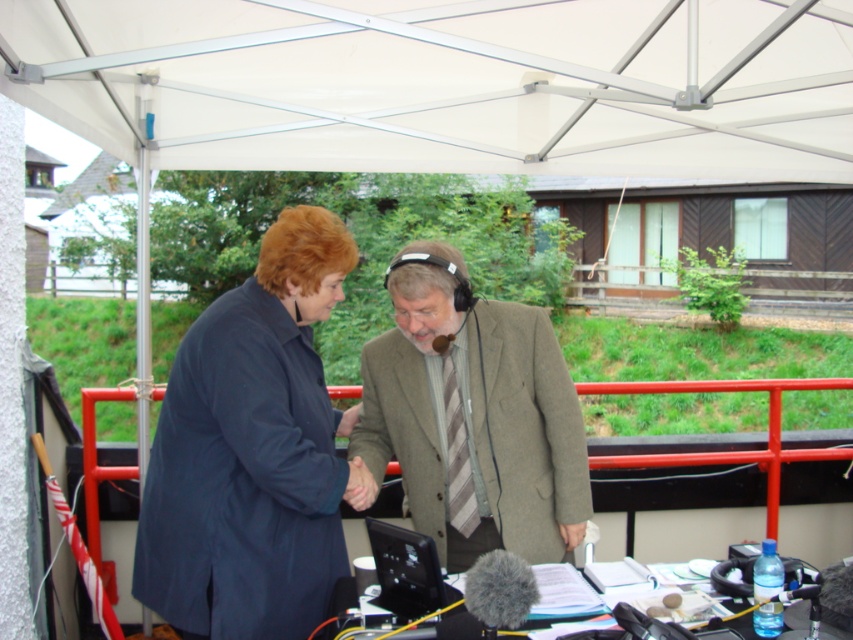
Question: Is white fabric canopy at upper center to the right of light brown textured coat at center from the viewer's perspective?

Choices:
 (A) yes
 (B) no

Answer: (A)

Question: Which point is farther to the camera?

Choices:
 (A) (167, 61)
 (B) (189, 356)
 (C) (492, 513)

Answer: (A)

Question: Which of the following is the farthest from the observer?

Choices:
 (A) (425, 435)
 (B) (338, 298)
 (C) (368, 154)

Answer: (C)

Question: Which point is closer to the camera?

Choices:
 (A) light brown textured coat at center
 (B) white fabric canopy at upper center

Answer: (B)

Question: Does dark blue coat at center lie in front of light brown textured coat at center?

Choices:
 (A) yes
 (B) no

Answer: (A)

Question: Considering the relative positions of white fabric canopy at upper center and dark blue coat at center in the image provided, where is white fabric canopy at upper center located with respect to dark blue coat at center?

Choices:
 (A) below
 (B) above

Answer: (B)